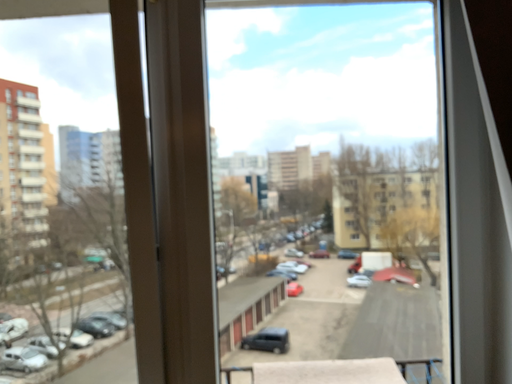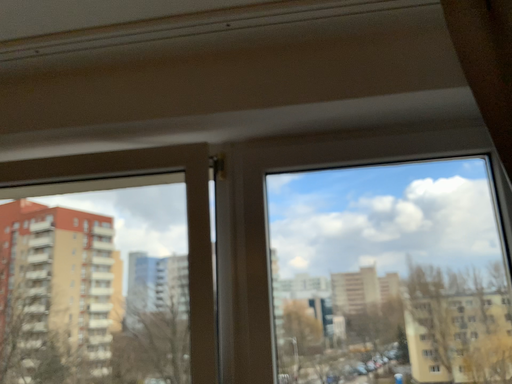
Question: How did the camera likely rotate when shooting the video?

Choices:
 (A) rotated upward
 (B) rotated downward

Answer: (A)